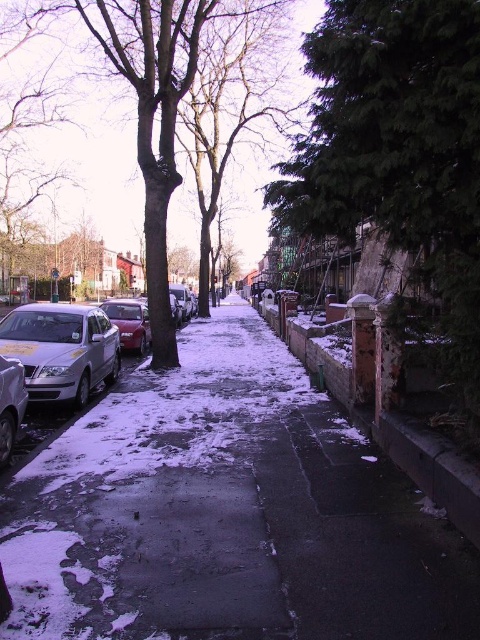
Does bare branches at center appear on the right side of shiny red car at left?

Indeed, bare branches at center is positioned on the right side of shiny red car at left.

Who is more distant from viewer, (265, 8) or (120, 323)?

The point (265, 8) is behind.

You are a GUI agent. You are given a task and a screenshot of the screen. Output one action in this format:
    pyautogui.click(x=<x>, y=<y>)
    Task: Click on the bare branches at center
    This screenshot has height=640, width=480.
    Given the screenshot: What is the action you would take?
    pyautogui.click(x=232, y=100)

Who is more distant from viewer, (277, 42) or (316, 333)?

Positioned behind is point (277, 42).

Does bare branches at center appear on the left side of brick wall at center?

Yes, bare branches at center is to the left of brick wall at center.

At what (x,y) coordinates should I click in order to perform the action: click on bare branches at center. Please return your answer as a coordinate pair (x, y). The image size is (480, 640). Looking at the image, I should click on (232, 100).

Can you confirm if silver metallic car at left is smaller than silver metallic car at lower left?

Actually, silver metallic car at left might be larger than silver metallic car at lower left.

Based on the photo, can you confirm if silver metallic car at left is taller than silver metallic car at lower left?

Yes.

Does point (63, 355) come farther from viewer compared to point (15, 394)?

Yes, point (63, 355) is farther from viewer.

The height and width of the screenshot is (640, 480). Find the location of `silver metallic car at left`. silver metallic car at left is located at coordinates (61, 349).